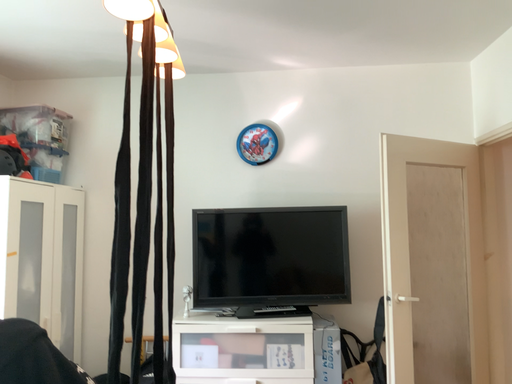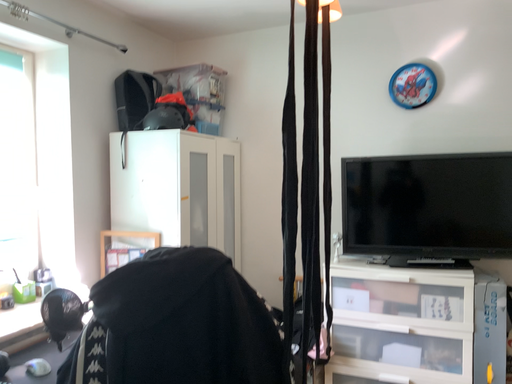
Question: How did the camera likely rotate when shooting the video?

Choices:
 (A) rotated left
 (B) rotated right

Answer: (A)